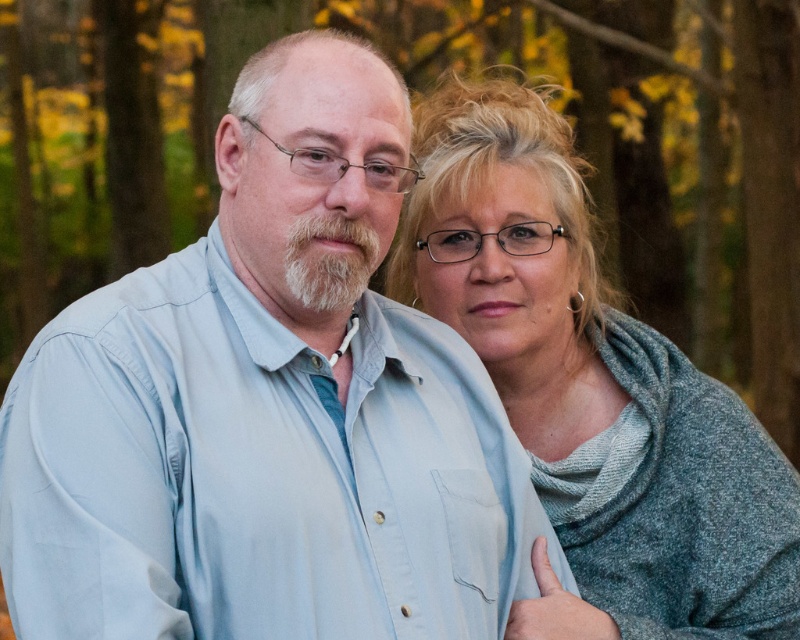
In the scene shown: You are a photographer trying to focus on the white fluffy beard at center in the image. However, your camera is currently focused on the light blue shirt at center. Can you adjust the focus to the beard without moving the camera? Explain why or why not based on their positions.

The light blue shirt at center is closer to the viewer than the white fluffy beard at center. Since the shirt is in front of the beard, adjusting focus from the shirt to the beard would require refocusing the camera to a slightly farther distance. However, without moving the camera, it is possible to adjust the focus to the beard by changing the focal point or using manual focus to shift attention to the beard while keeping the camera position fixed.

You are a photographer setting up a portrait shoot in an autumn forest. You have two props to place in front of the camera lens to frame the scene. The props are a light blue shirt at center and a white fluffy beard at center. Given their sizes, which prop will block more of the background view?

The light blue shirt at center is much taller than the white fluffy beard at center, so it will block more of the background view.

Based on the photo, you are a photographer adjusting your camera settings to focus on both the light blue shirt at center and the white fluffy beard at center. Since the background is blurred, which object should you prioritize focusing on to ensure it appears sharp? Explain your reasoning based on their positions.

The light blue shirt at center is located below the white fluffy beard at center. Since the beard is above the shirt, it is closer to the camera. To ensure both are in focus, prioritize focusing on the white fluffy beard at center because it is closer and requires proper focus first, then adjust for the shirt if needed.